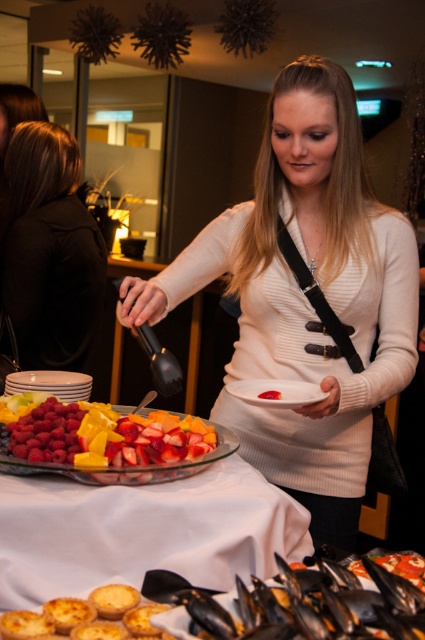
Question: Can you confirm if black fabric hair at left is positioned to the right of golden-brown flaky pastry at lower left?

Choices:
 (A) no
 (B) yes

Answer: (A)

Question: Which of the following is the farthest from the observer?

Choices:
 (A) black fabric hair at left
 (B) golden-brown flaky pastry at lower left
 (C) translucent glass bowl of fruit at center

Answer: (A)

Question: Which object is positioned closest to the white matte plate at center?

Choices:
 (A) translucent glass platter at center
 (B) translucent glass bowl of fruit at center
 (C) golden-brown flaky pastry at lower left
 (D) white matte sweater at center

Answer: (A)

Question: Can you confirm if white matte sweater at center is positioned above translucent glass bowl of fruit at center?

Choices:
 (A) no
 (B) yes

Answer: (B)

Question: From the image, what is the correct spatial relationship of white matte sweater at center in relation to black fabric hair at left?

Choices:
 (A) above
 (B) below

Answer: (B)

Question: Which point is farther to the camera?

Choices:
 (A) (295, 385)
 (B) (85, 604)
 (C) (260, 348)

Answer: (C)